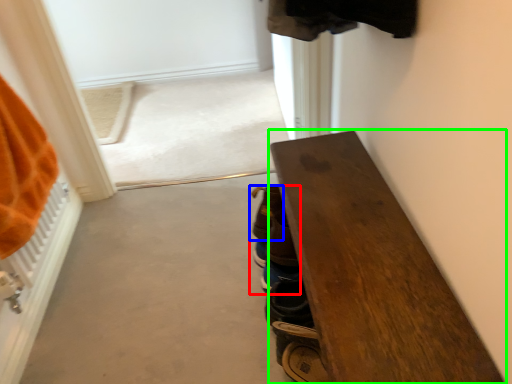
Question: Estimate the real-world distances between objects in this image. Which object is farther from footwear (highlighted by a red box), footwear (highlighted by a blue box) or furniture (highlighted by a green box)?

Choices:
 (A) footwear
 (B) furniture

Answer: (B)